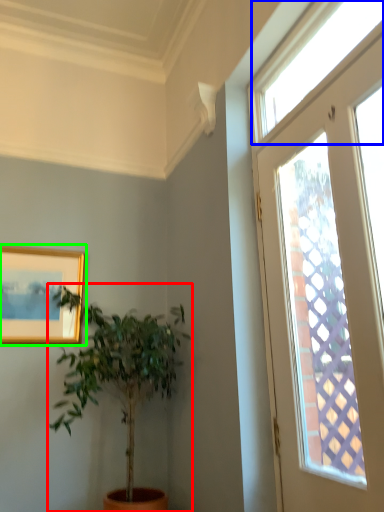
Question: Estimate the real-world distances between objects in this image. Which object is closer to houseplant (highlighted by a red box), window (highlighted by a blue box) or picture frame (highlighted by a green box)?

Choices:
 (A) window
 (B) picture frame

Answer: (B)